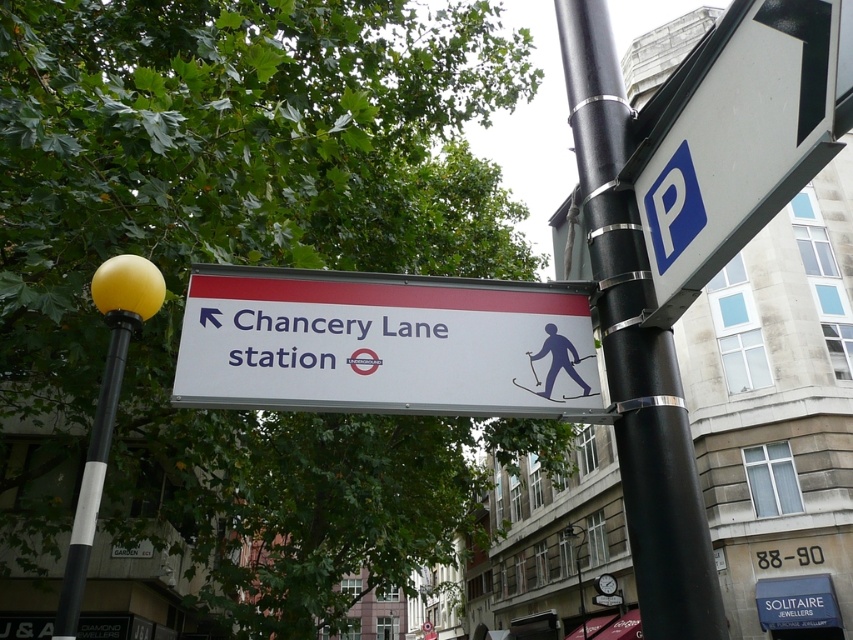
You are a photographer standing in front of the Chancery Lane station sign. You have two points marked on your camera screen at coordinates point (738, 248) and point (589, 100). Which point is closer to your camera lens?

Point (738, 248) is closer to the camera lens than point (589, 100).

You are a visually impaired pedestrian using a cane. You see the white plastic sign at center and the black metallic pole at upper right. Which object is positioned to the left from your perspective?

The white plastic sign at center is to the left of the black metallic pole at upper right.

You are a delivery robot with a 24 inch wide package. You need to navigate between the white plastic sign at center and the black metallic pole at upper right. Can you fit through the space between them?

The distance between the white plastic sign at center and the black metallic pole at upper right is 26.76 inches. Since your package is 24 inches wide, you can fit through the space between them as the gap is wider than the package.